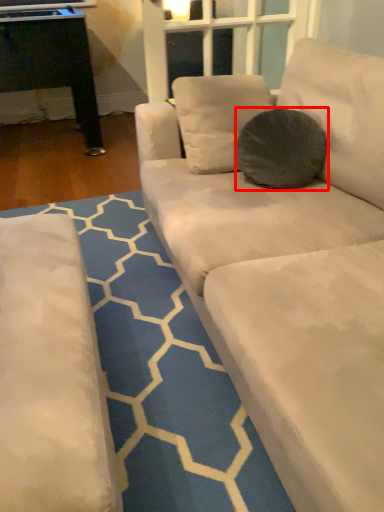
Question: From the image's perspective, what is the correct spatial relationship of throw pillow (annotated by the red box) in relation to pattern?

Choices:
 (A) below
 (B) above

Answer: (B)